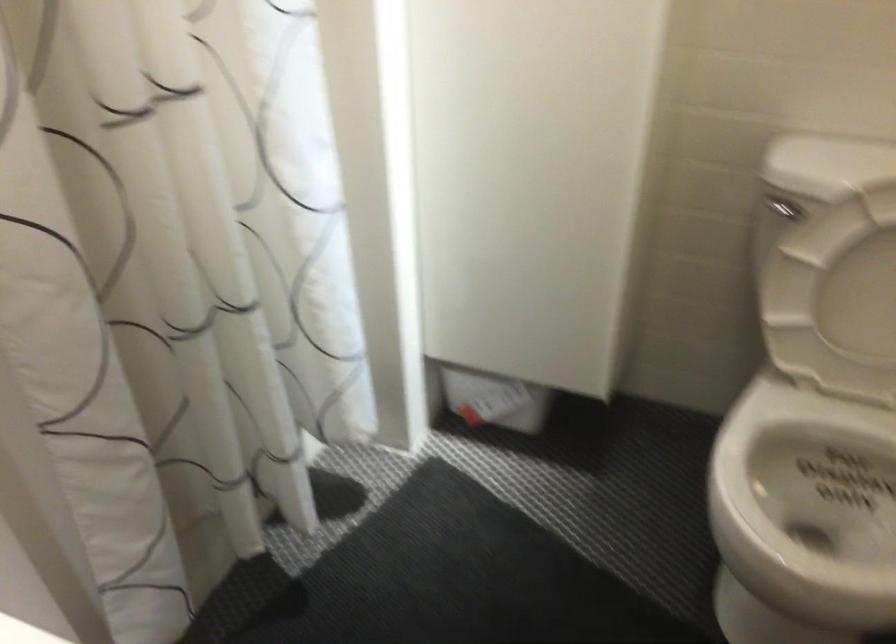
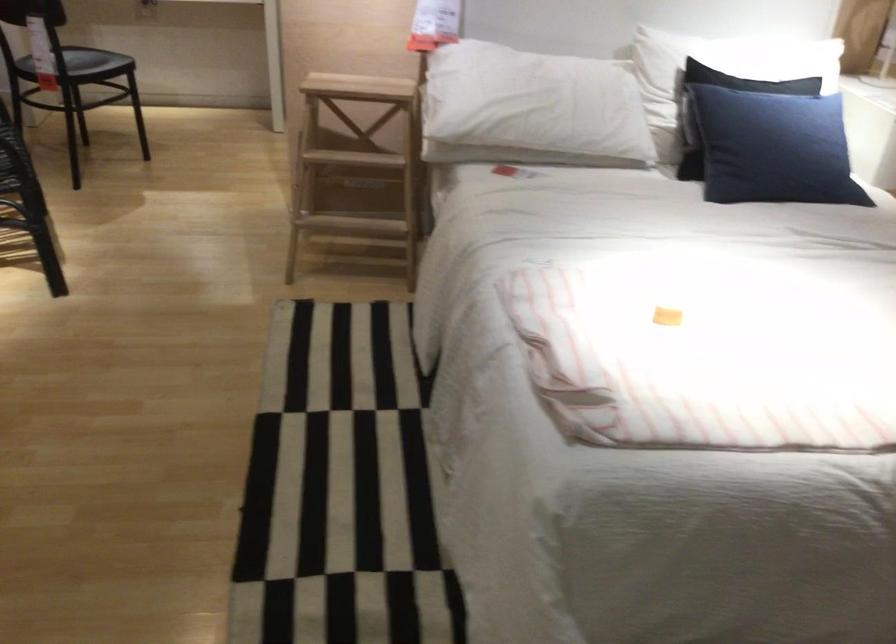
Question: I am providing you with two images of the same scene from different viewpoints. Which of the following objects are not visible in image2?

Choices:
 (A) white toilet seat
 (B) wooden step stool
 (C) turquoise suitcase
 (D) black pillow

Answer: (A)